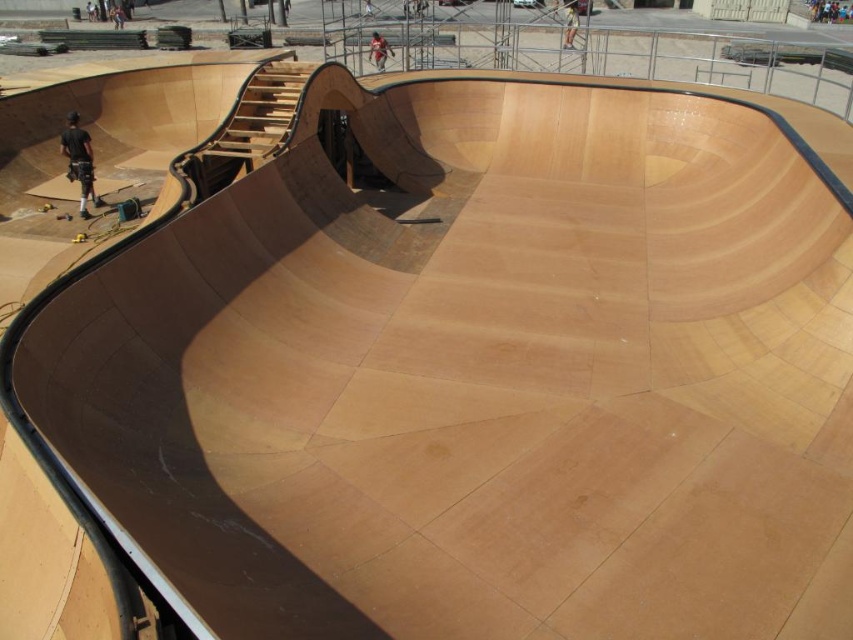
Is light brown wooden skateboard at upper center to the right of light brown wooden skateboarder at upper center from the viewer's perspective?

Incorrect, light brown wooden skateboard at upper center is not on the right side of light brown wooden skateboarder at upper center.

Does light brown wooden skateboard at upper center appear under light brown wooden skateboarder at upper center?

Yes.

Where is `light brown wooden skateboard at upper center`? The height and width of the screenshot is (640, 853). light brown wooden skateboard at upper center is located at coordinates (379, 51).

This screenshot has width=853, height=640. I want to click on light brown wooden skateboard at upper center, so click(379, 51).

Which is more to the left, black leather pants at left or light brown wooden skateboard at upper center?

From the viewer's perspective, black leather pants at left appears more on the left side.

Who is taller, black leather pants at left or light brown wooden skateboard at upper center?

light brown wooden skateboard at upper center

I want to click on black leather pants at left, so click(x=79, y=161).

At what (x,y) coordinates should I click in order to perform the action: click on black leather pants at left. Please return your answer as a coordinate pair (x, y). This screenshot has height=640, width=853. Looking at the image, I should click on (79, 161).

Which of these two, black leather pants at left or light brown wooden skateboarder at upper center, stands shorter?

With less height is black leather pants at left.

I want to click on black leather pants at left, so click(x=79, y=161).

Find the location of `black leather pants at left`. black leather pants at left is located at coordinates (79, 161).